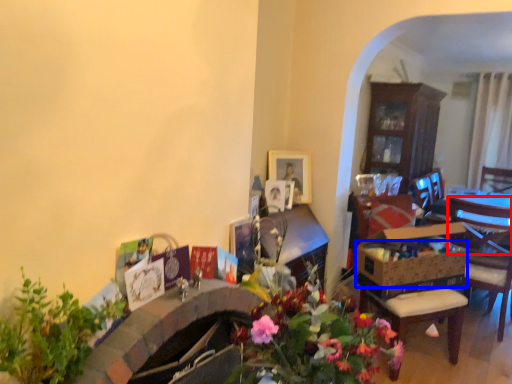
Question: Which point is closer to the camera, chair (highlighted by a red box) or flower basket (highlighted by a blue box)?

Choices:
 (A) chair
 (B) flower basket

Answer: (B)